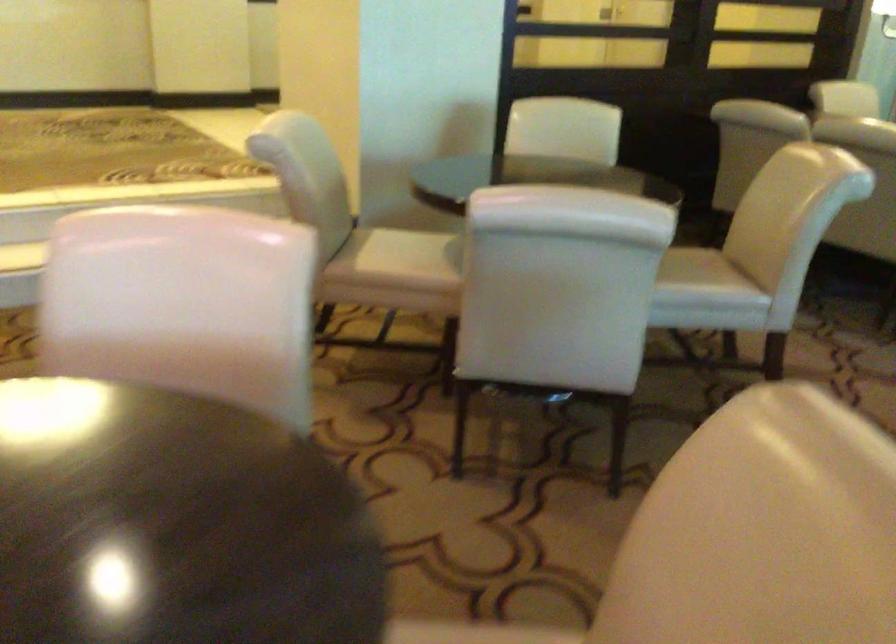
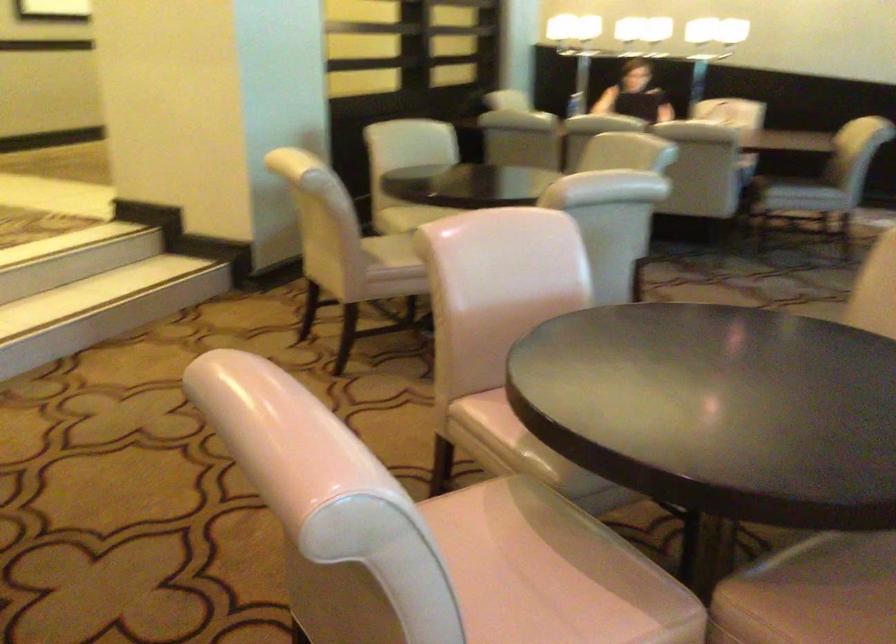
Question: I am providing you with two images of the same scene from different viewpoints. Which of the following objects are not visible in image2?

Choices:
 (A) beige chair sitting surface
 (B) chair sitting surface
 (C) pink chair sitting surface
 (D) none of these

Answer: (D)